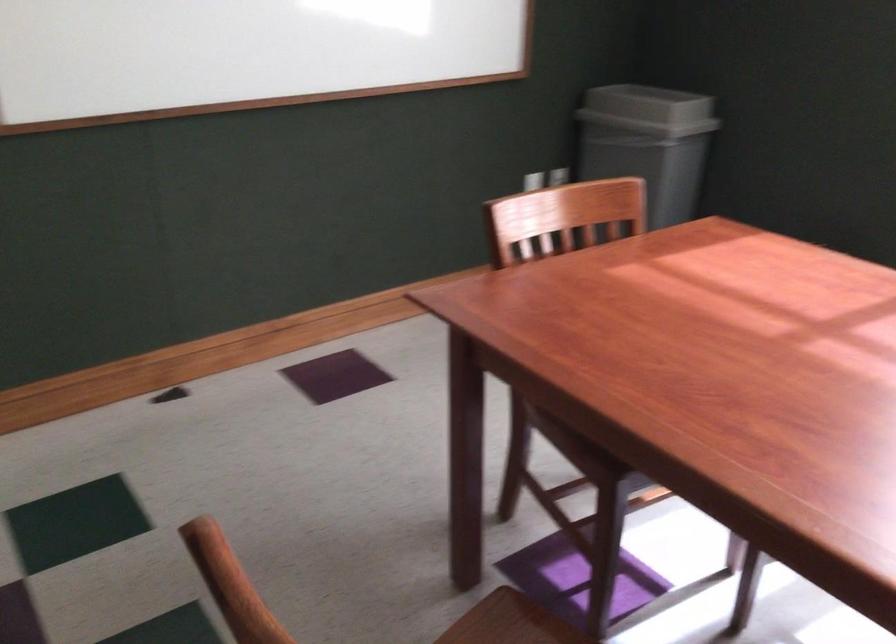
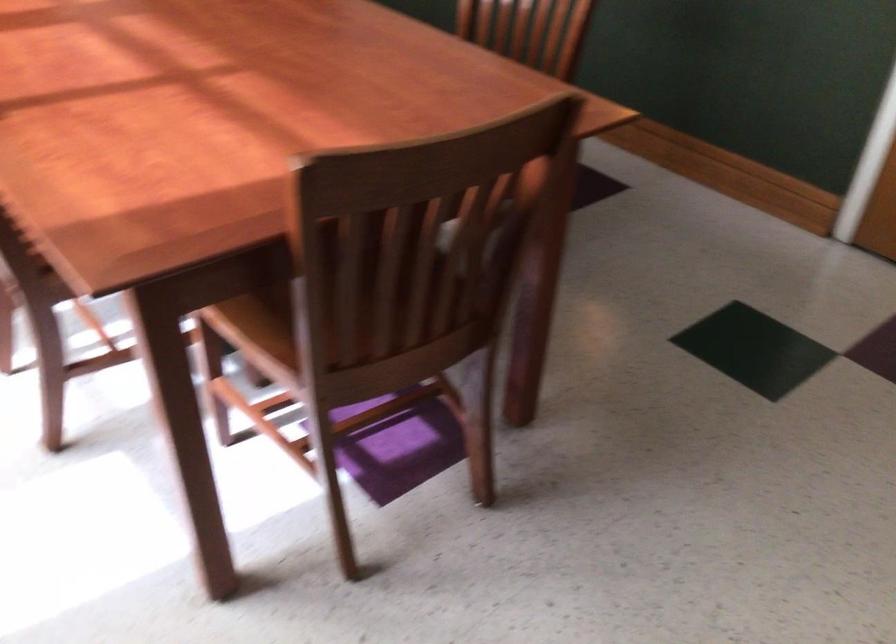
Question: I am providing you with two images of the same scene from different viewpoints. Please identify which objects are invisible in image2.

Choices:
 (A) wooden chair sitting surface
 (B) long cardboard box
 (C) purple square object
 (D) chair sitting surface

Answer: (D)